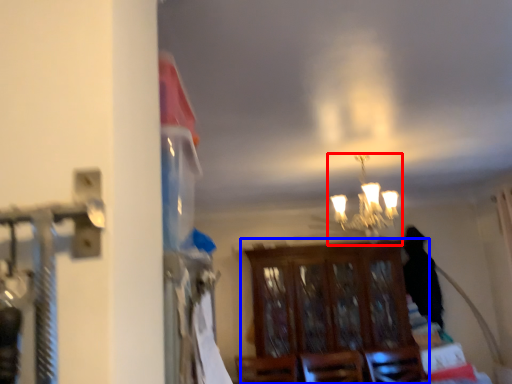
Question: Which of the following is the closest to the observer, lamp (highlighted by a red box) or furniture (highlighted by a blue box)?

Choices:
 (A) lamp
 (B) furniture

Answer: (A)